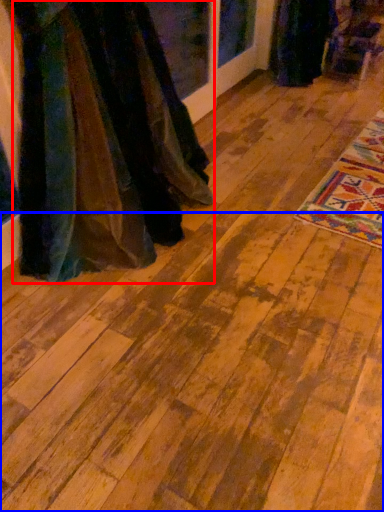
Question: Which of the following is the closest to the observer, fancy dress (highlighted by a red box) or plywood (highlighted by a blue box)?

Choices:
 (A) fancy dress
 (B) plywood

Answer: (B)